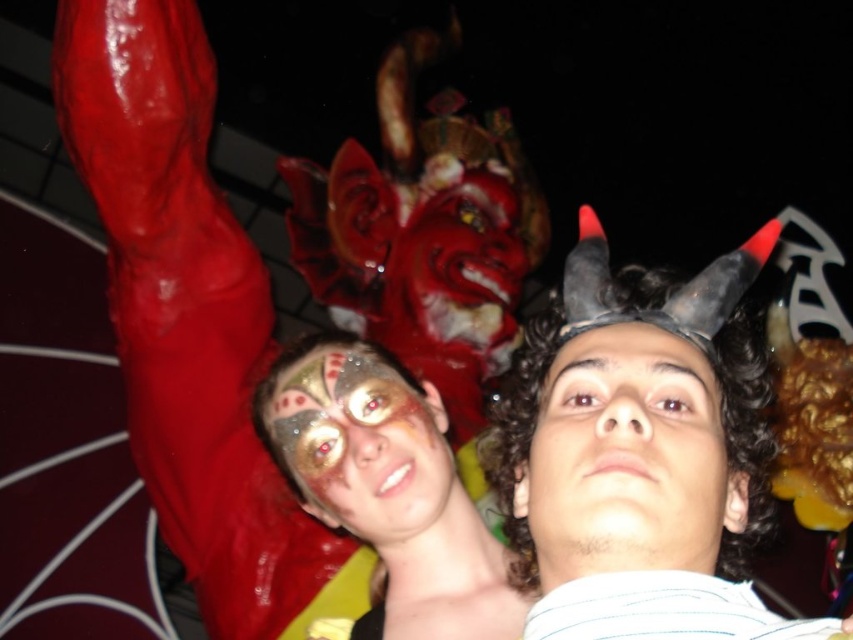
Is point (405, 529) positioned in front of point (294, 369)?

Yes.

The image size is (853, 640). What do you see at coordinates (387, 484) in the screenshot? I see `matte gold face paint at center` at bounding box center [387, 484].

Locate an element on the screen. Image resolution: width=853 pixels, height=640 pixels. matte gold face paint at center is located at coordinates (387, 484).

Can you confirm if glossy red latex at upper left is positioned above matte gold face paint at center?

Yes.

Does glossy red latex at upper left have a greater height compared to matte gold face paint at center?

Yes.

Which is in front, point (323, 448) or point (329, 392)?

Positioned in front is point (323, 448).

Where is `glossy red latex at upper left`? The image size is (853, 640). glossy red latex at upper left is located at coordinates [286, 353].

Is black matte horns at upper center further to the viewer compared to matte gold face paint at center?

No, it is in front of matte gold face paint at center.

Is black matte horns at upper center below matte gold face paint at center?

No.

What are the coordinates of `black matte horns at upper center` in the screenshot? It's located at pos(633,422).